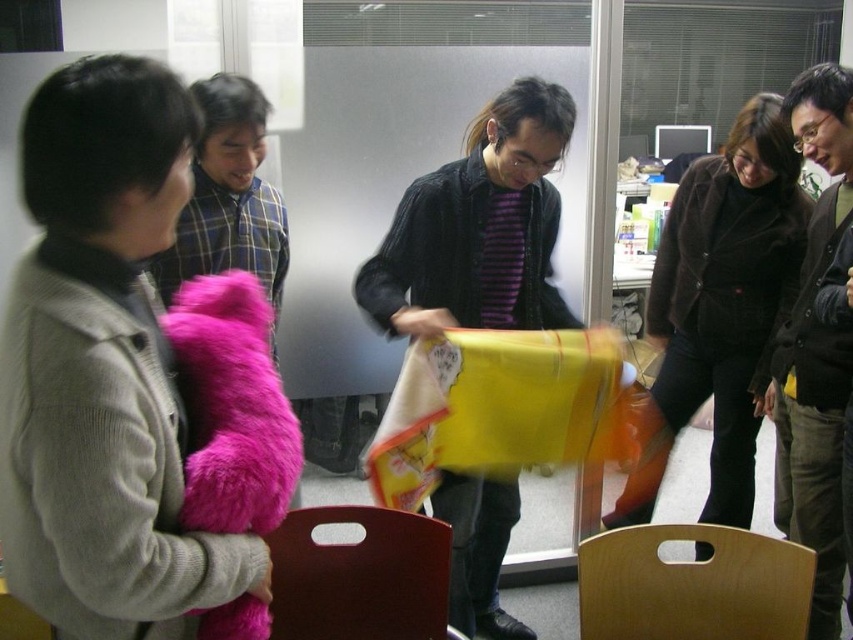
Between point (480, 147) and point (840, 108), which one is positioned behind?

Point (480, 147)

Which is behind, point (505, 282) or point (816, 465)?

Positioned behind is point (505, 282).

I want to click on purple striped sweater at center, so click(x=479, y=227).

Looking at this image, is purple striped sweater at center above fuzzy pink teddy bear at left?

Yes.

Who is positioned more to the right, purple striped sweater at center or fuzzy pink teddy bear at left?

purple striped sweater at center

You are a GUI agent. You are given a task and a screenshot of the screen. Output one action in this format:
    pyautogui.click(x=<x>, y=<y>)
    Task: Click on the purple striped sweater at center
    The height and width of the screenshot is (640, 853).
    Given the screenshot: What is the action you would take?
    pyautogui.click(x=479, y=227)

Does plush pink fur at left have a smaller size compared to velvet brown coat at upper right?

Correct, plush pink fur at left occupies less space than velvet brown coat at upper right.

Between point (93, 528) and point (781, 227), which one is positioned behind?

The point (781, 227) is more distant.

In order to click on plush pink fur at left in this screenshot , I will do click(103, 369).

Image resolution: width=853 pixels, height=640 pixels. Find the location of `plush pink fur at left`. plush pink fur at left is located at coordinates (103, 369).